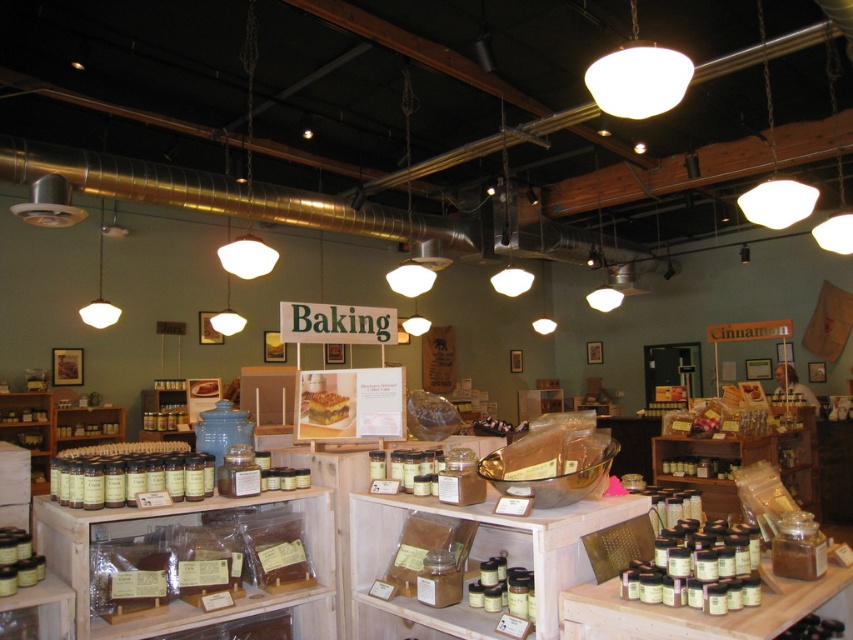
Question: Which point is closer to the camera?

Choices:
 (A) matte wood spice rack at lower left
 (B) clear plastic container at center
 (C) matte brown wood shelf at lower left
 (D) golden brown cake at center

Answer: (B)

Question: Can you confirm if matte brown wood shelf at lower left is positioned to the left of wooden shelf at lower left?

Choices:
 (A) yes
 (B) no

Answer: (B)

Question: Does clear plastic container at center have a lesser width compared to matte wood spice rack at lower left?

Choices:
 (A) yes
 (B) no

Answer: (B)

Question: Among these objects, which one is farthest from the camera?

Choices:
 (A) wooden shelf at lower left
 (B) translucent plastic bag at center
 (C) matte brown wood shelf at lower left
 (D) clear plastic container at center

Answer: (B)

Question: Is matte brown wood shelf at lower left bigger than translucent plastic bag at center?

Choices:
 (A) no
 (B) yes

Answer: (A)

Question: Which object appears closest to the camera in this image?

Choices:
 (A) clear plastic container at center
 (B) translucent plastic bag at center
 (C) wooden shelf at lower left
 (D) matte brown wood shelf at lower left

Answer: (A)